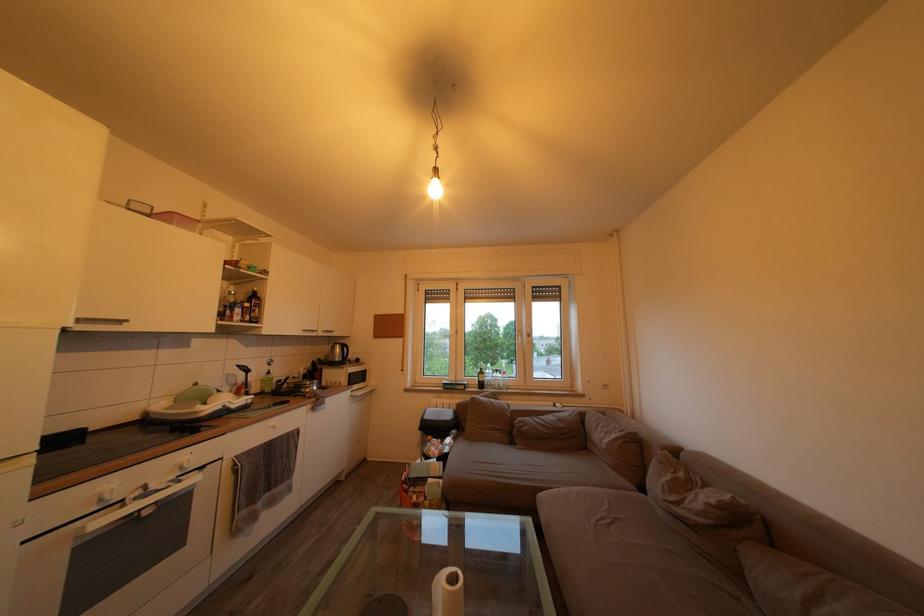
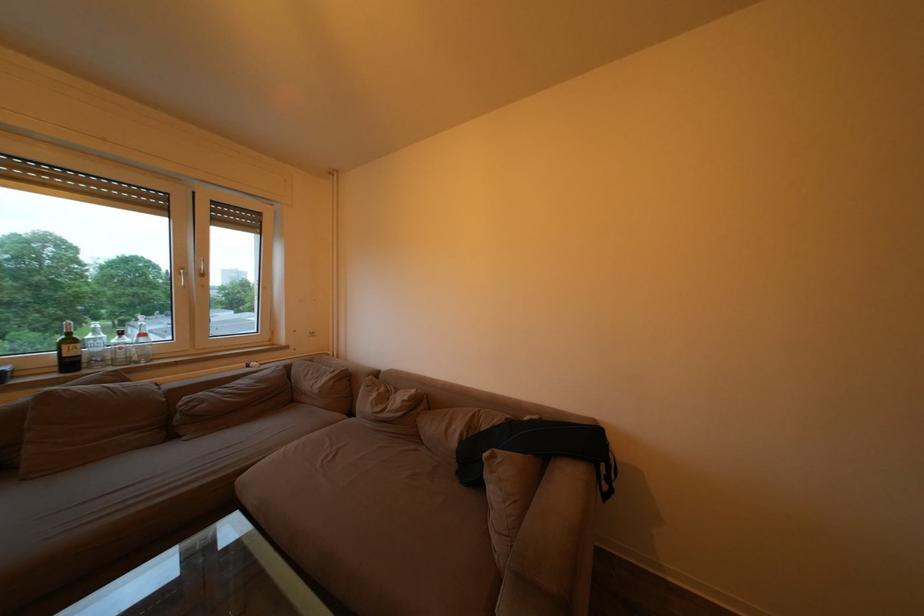
Where in the second image is the point corresponding to (x=490, y=379) from the first image?

(79, 347)